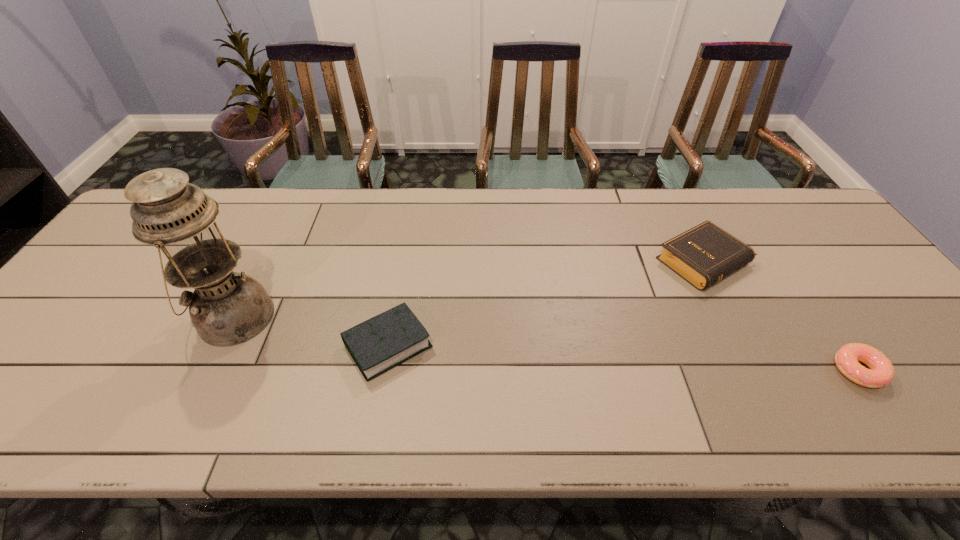
Identify the location of free space located on the right of the doughnut. (949, 370).

What are the coordinates of `object present at the far edge` in the screenshot? It's located at (705, 254).

This screenshot has width=960, height=540. Find the location of `object present at the right edge`. object present at the right edge is located at coordinates (881, 372).

You are a GUI agent. You are given a task and a screenshot of the screen. Output one action in this format:
    pyautogui.click(x=<x>, y=<y>)
    Task: Click on the vacant space at the far edge of the desktop
    
    Given the screenshot: What is the action you would take?
    pyautogui.click(x=350, y=193)

Find the location of a particular element. This screenshot has width=960, height=540. vacant area at the near edge is located at coordinates [809, 404].

At what (x,y) coordinates should I click in order to perform the action: click on free space at the left edge of the desktop. Please return your answer as a coordinate pair (x, y). The image size is (960, 540). Looking at the image, I should click on (68, 339).

The height and width of the screenshot is (540, 960). Identify the location of blank space at the right edge. (916, 362).

Identify the location of vacant space that's between the doughnut and the farther Bible. (781, 316).

Identify the location of vacant area between the leftmost object and the rightmost object. The image size is (960, 540). (546, 344).

Locate an element on the screen. Image resolution: width=960 pixels, height=540 pixels. free space between the rightmost object and the third object from left to right is located at coordinates (781, 316).